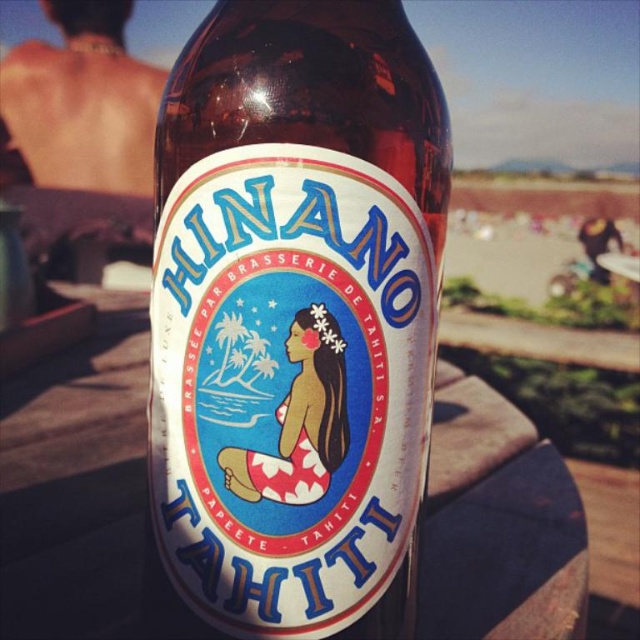
Who is lower down, translucent glass bottle at center or skinny tan skin at upper left?

translucent glass bottle at center is below.

Between translucent glass bottle at center and skinny tan skin at upper left, which one appears on the left side from the viewer's perspective?

skinny tan skin at upper left

Is point (225, 547) closer to camera compared to point (134, 115)?

That is True.

Identify the location of translucent glass bottle at center. This screenshot has height=640, width=640. (296, 316).